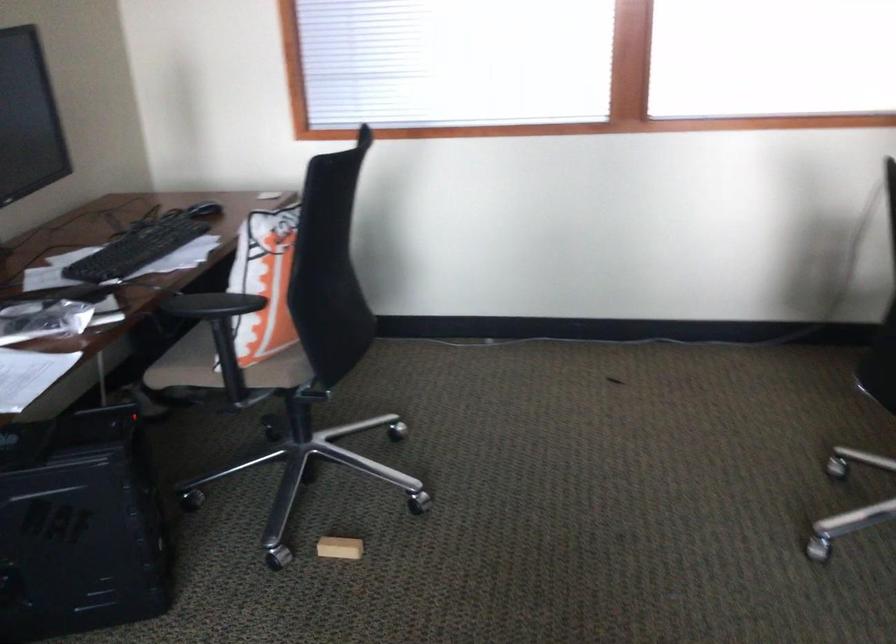
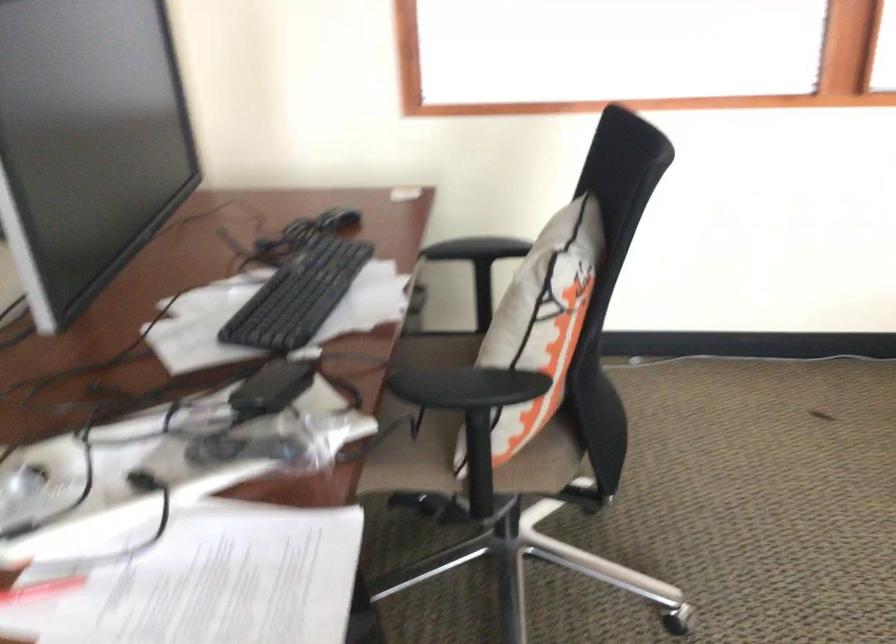
Question: The first image is from the beginning of the video and the second image is from the end. How did the camera likely rotate when shooting the video?

Choices:
 (A) Left
 (B) Right
 (C) Up
 (D) Down

Answer: (B)